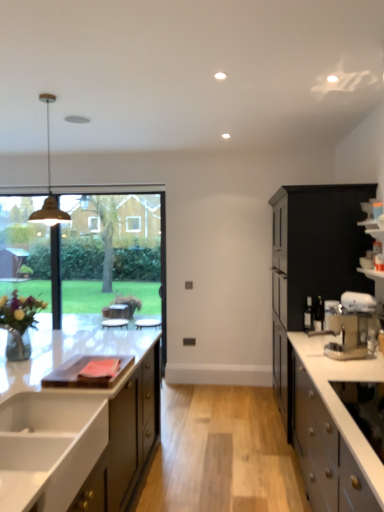
Question: Could you tell me if matte white cabinetry at left, positioned as the third cabinetry in right-to-left order, is facing metallic silver coffee machine at right?

Choices:
 (A) yes
 (B) no

Answer: (B)

Question: Does matte white cabinetry at left, positioned as the third cabinetry in right-to-left order, have a lesser width compared to metallic silver coffee machine at right?

Choices:
 (A) yes
 (B) no

Answer: (B)

Question: Is matte white cabinetry at left, which is the 1th cabinetry in left-to-right order, far from metallic silver coffee machine at right?

Choices:
 (A) no
 (B) yes

Answer: (B)

Question: Can you confirm if matte white cabinetry at left, positioned as the third cabinetry in right-to-left order, is taller than metallic silver coffee machine at right?

Choices:
 (A) no
 (B) yes

Answer: (B)

Question: From a real-world perspective, is matte white cabinetry at left, which is the 1th cabinetry in left-to-right order, physically below metallic silver coffee machine at right?

Choices:
 (A) no
 (B) yes

Answer: (B)

Question: Is metallic silver coffee machine at right completely or partially inside matte white cabinetry at left, positioned as the third cabinetry in right-to-left order?

Choices:
 (A) yes
 (B) no

Answer: (B)

Question: From a real-world perspective, is matte black cabinet at right, the 1th cabinetry in the right-to-left sequence, positioned over matte brass pendant light at upper left based on gravity?

Choices:
 (A) no
 (B) yes

Answer: (A)

Question: Is matte black cabinet at right, the 1th cabinetry in the right-to-left sequence, positioned before matte brass pendant light at upper left?

Choices:
 (A) no
 (B) yes

Answer: (A)

Question: Can you confirm if matte black cabinet at right, the 1th cabinetry in the right-to-left sequence, is taller than matte brass pendant light at upper left?

Choices:
 (A) no
 (B) yes

Answer: (B)

Question: From the image's perspective, is matte black cabinet at right, which is the third cabinetry from left to right, under matte brass pendant light at upper left?

Choices:
 (A) no
 (B) yes

Answer: (B)

Question: Considering the relative sizes of matte black cabinet at right, the 1th cabinetry in the right-to-left sequence, and matte brass pendant light at upper left in the image provided, is matte black cabinet at right, the 1th cabinetry in the right-to-left sequence, shorter than matte brass pendant light at upper left?

Choices:
 (A) no
 (B) yes

Answer: (A)

Question: Does matte black cabinet at right, which is the third cabinetry from left to right, come behind matte brass pendant light at upper left?

Choices:
 (A) no
 (B) yes

Answer: (B)

Question: From a real-world perspective, is white glossy sink at lower left on top of matte black cabinet at right, the 1th cabinetry in the right-to-left sequence?

Choices:
 (A) no
 (B) yes

Answer: (A)